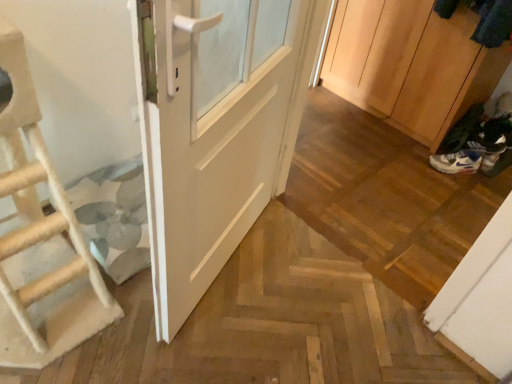
I want to click on free space in front of white matte door at center, so click(211, 336).